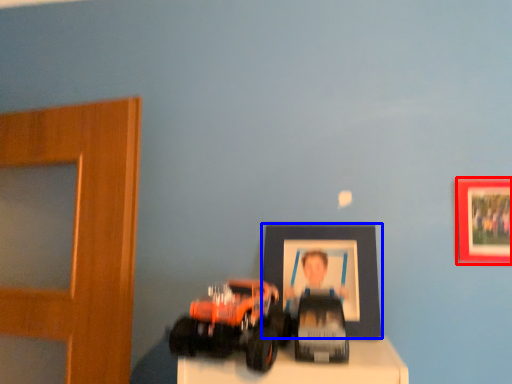
Question: Which object appears farthest to the camera in this image, picture frame (highlighted by a red box) or picture frame (highlighted by a blue box)?

Choices:
 (A) picture frame
 (B) picture frame

Answer: (B)